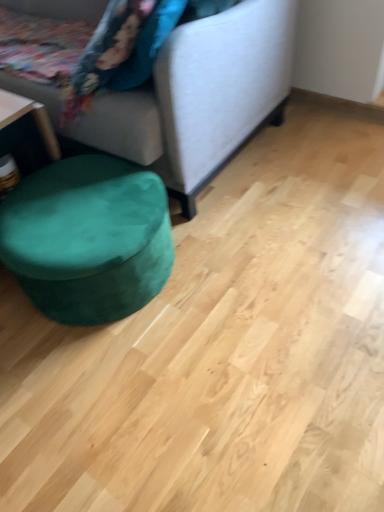
You are a GUI agent. You are given a task and a screenshot of the screen. Output one action in this format:
    pyautogui.click(x=<x>, y=<y>)
    Task: Click on the free space above velvet green ottoman at lower left (from a real-world perspective)
    The image size is (384, 512).
    Given the screenshot: What is the action you would take?
    pyautogui.click(x=80, y=204)